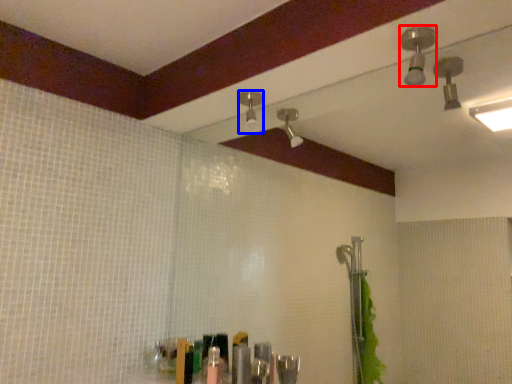
Question: Which point is further to the camera, shower (highlighted by a red box) or shower (highlighted by a blue box)?

Choices:
 (A) shower
 (B) shower

Answer: (B)